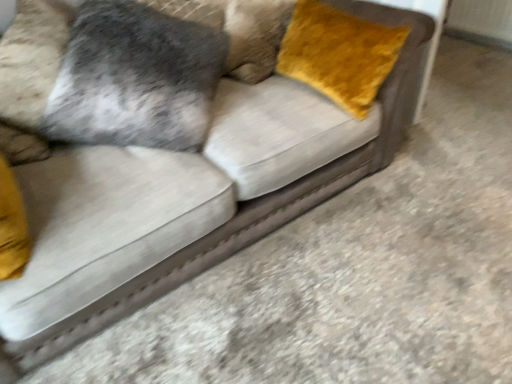
Question: Is velvet gray pillow at upper left directly adjacent to velvet yellow pillow at upper right?

Choices:
 (A) yes
 (B) no

Answer: (B)

Question: Can you confirm if velvet gray pillow at upper left is positioned to the left of velvet yellow pillow at upper right?

Choices:
 (A) no
 (B) yes

Answer: (B)

Question: Does velvet gray pillow at upper left have a greater height compared to velvet yellow pillow at upper right?

Choices:
 (A) yes
 (B) no

Answer: (B)

Question: Can you confirm if velvet gray pillow at upper left is wider than velvet yellow pillow at upper right?

Choices:
 (A) yes
 (B) no

Answer: (A)

Question: From a real-world perspective, is velvet gray pillow at upper left positioned under velvet yellow pillow at upper right based on gravity?

Choices:
 (A) no
 (B) yes

Answer: (A)

Question: From the image's perspective, is velvet gray pillow at upper left over velvet yellow pillow at upper right?

Choices:
 (A) yes
 (B) no

Answer: (A)

Question: Is velvet yellow pillow at upper right positioned far away from velvet gray pillow at upper left?

Choices:
 (A) no
 (B) yes

Answer: (A)

Question: Can you confirm if velvet yellow pillow at upper right is smaller than velvet gray pillow at upper left?

Choices:
 (A) no
 (B) yes

Answer: (B)

Question: From the image's perspective, is velvet yellow pillow at upper right located beneath velvet gray pillow at upper left?

Choices:
 (A) no
 (B) yes

Answer: (B)

Question: Considering the relative sizes of velvet yellow pillow at upper right and velvet gray pillow at upper left in the image provided, is velvet yellow pillow at upper right shorter than velvet gray pillow at upper left?

Choices:
 (A) no
 (B) yes

Answer: (A)

Question: Can we say velvet yellow pillow at upper right lies outside velvet gray pillow at upper left?

Choices:
 (A) no
 (B) yes

Answer: (B)

Question: Is velvet yellow pillow at upper right positioned in front of velvet gray pillow at upper left?

Choices:
 (A) no
 (B) yes

Answer: (B)

Question: Does point (308, 34) appear closer or farther from the camera than point (55, 86)?

Choices:
 (A) farther
 (B) closer

Answer: (A)